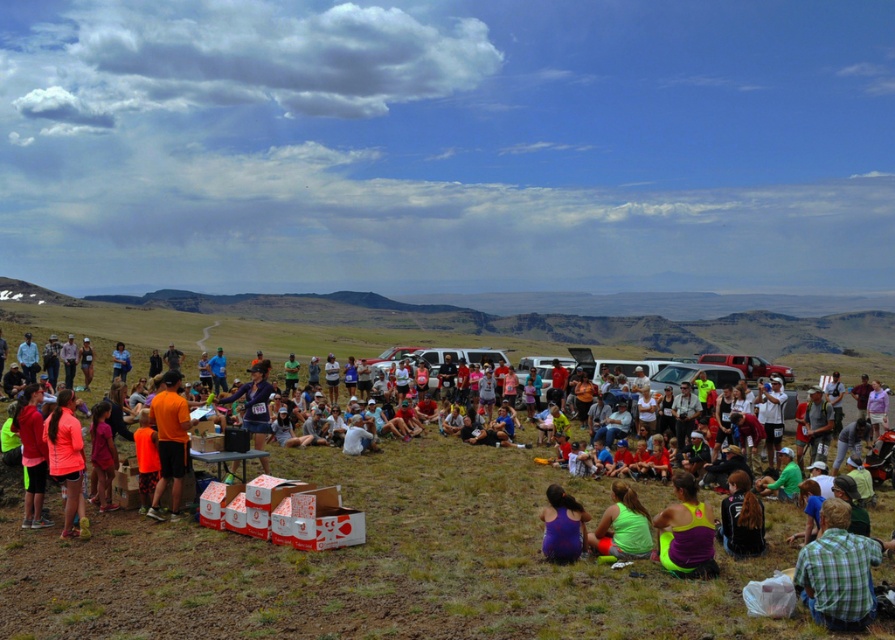
Does orange fabric shirt at center have a larger size compared to neon orange fabric at lower left?

Indeed, orange fabric shirt at center has a larger size compared to neon orange fabric at lower left.

Which is above, orange fabric shirt at center or neon orange fabric at lower left?

orange fabric shirt at center is above.

Describe the element at coordinates (169, 442) in the screenshot. I see `orange fabric shirt at center` at that location.

The height and width of the screenshot is (640, 895). What are the coordinates of `orange fabric shirt at center` in the screenshot? It's located at pos(169,442).

Which is behind, point (834, 513) or point (64, 525)?

Point (64, 525)

Which is more to the right, green plaid shirt at lower right or neon orange fabric at lower left?

green plaid shirt at lower right is more to the right.

At what (x,y) coordinates should I click in order to perform the action: click on green plaid shirt at lower right. Please return your answer as a coordinate pair (x, y). Looking at the image, I should click on (837, 572).

The width and height of the screenshot is (895, 640). What do you see at coordinates (621, 525) in the screenshot? I see `green matte tank top at lower center` at bounding box center [621, 525].

How far apart are green matte tank top at lower center and shiny purple jacket at lower right?

The distance of green matte tank top at lower center from shiny purple jacket at lower right is 6.54 feet.

At what (x,y) coordinates should I click in order to perform the action: click on green matte tank top at lower center. Please return your answer as a coordinate pair (x, y). Looking at the image, I should click on (621, 525).